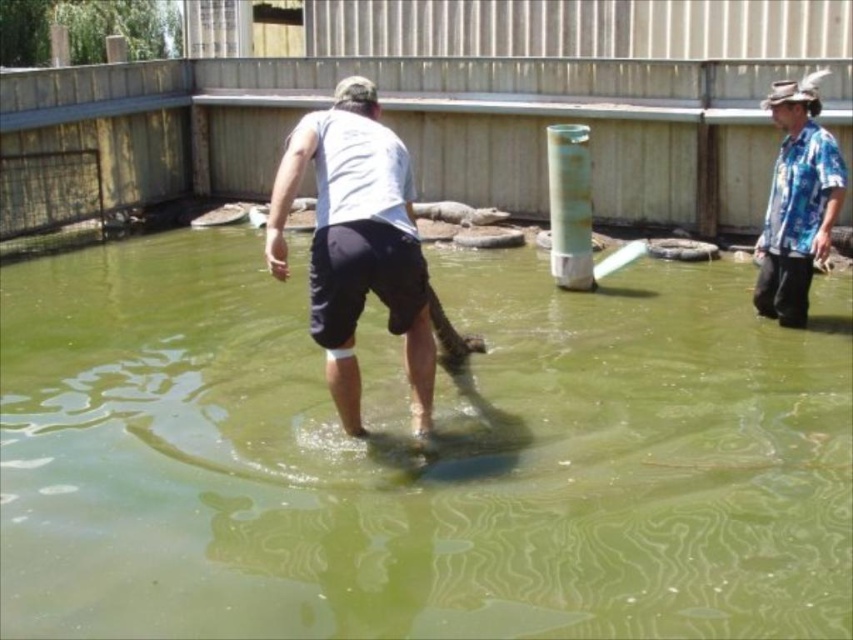
You are a visitor at the sanctuary and want to take a photo of the blue floral shirt at right without the green smooth water at center appearing in the foreground. Is this possible?

The green smooth water at center is closer to the viewer than the blue floral shirt at right, so the water will appear in front of the shirt in the photo. To avoid the water, you need to adjust your position so the shirt is closer or the water is farther away.

You are a zookeeper trying to locate two specific points marked in the image. The first point is at coordinates point (492, 589) and the second is at point (776, 273). If you were to walk from the first point to the second, would you be moving towards the background or the foreground of the image?

Since point (492, 589) is in front of point (776, 273), moving from the first point to the second would mean moving towards the background of the image.

You are a visitor at the sanctuary and want to take a photo of the blue floral shirt at right without the green smooth water at center in the shot. Is it possible to angle your camera to exclude the water?

The green smooth water at center is positioned under the blue floral shirt at right, so angling the camera upwards to focus on the shirt while avoiding the water below should work.